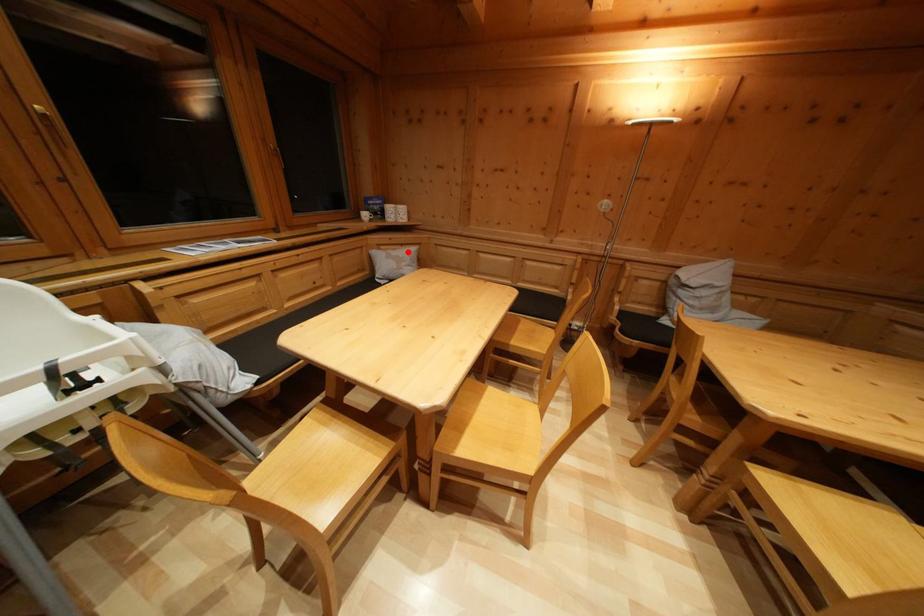
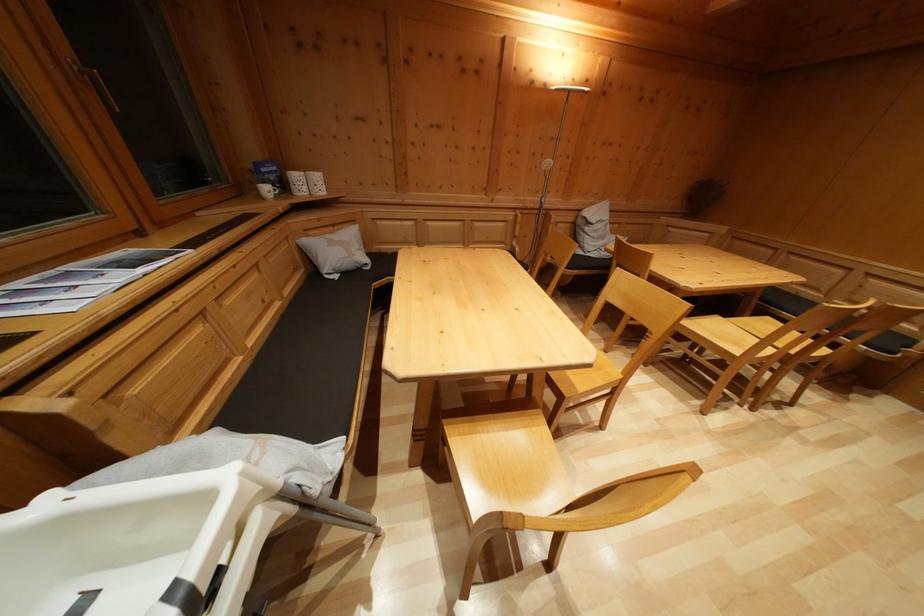
In the second image, find the point that corresponds to the highlighted location in the first image.

(338, 233)